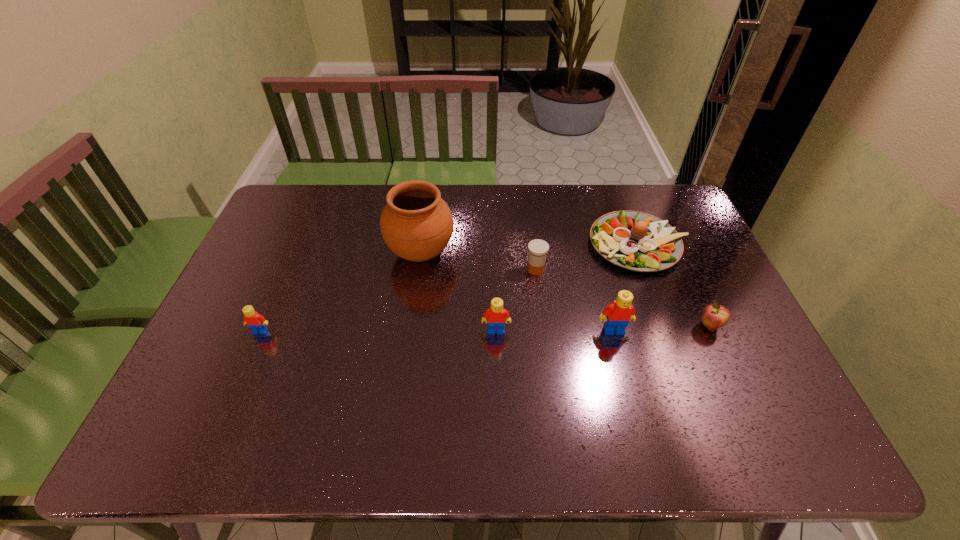
At what (x,y) coordinates should I click in order to perform the action: click on apple. Please return your answer as a coordinate pair (x, y). The width and height of the screenshot is (960, 540). Looking at the image, I should click on (714, 316).

Locate an element on the screen. This screenshot has width=960, height=540. vacant space located 0.120m on the face of the leftmost object is located at coordinates (242, 375).

Where is `free location located on the face of the third tallest object`? free location located on the face of the third tallest object is located at coordinates (497, 372).

Find the location of `free space located on the face of the tallest Lego`. free space located on the face of the tallest Lego is located at coordinates (621, 359).

This screenshot has height=540, width=960. Find the location of `vacant area situated 0.390m on the left of the second object from left to right`. vacant area situated 0.390m on the left of the second object from left to right is located at coordinates (263, 253).

Where is `vacant area located 0.130m on the front of the salad plate`? vacant area located 0.130m on the front of the salad plate is located at coordinates (662, 310).

Identify the location of free space located 0.330m on the label of the medicine. This screenshot has width=960, height=540. (418, 269).

Where is `vacant space located 0.270m on the label of the medicine`? The width and height of the screenshot is (960, 540). vacant space located 0.270m on the label of the medicine is located at coordinates (437, 269).

The width and height of the screenshot is (960, 540). Find the location of `vacant region located on the label of the medicine`. vacant region located on the label of the medicine is located at coordinates (510, 269).

Identify the location of vacant space located 0.310m on the back of the apple. (672, 242).